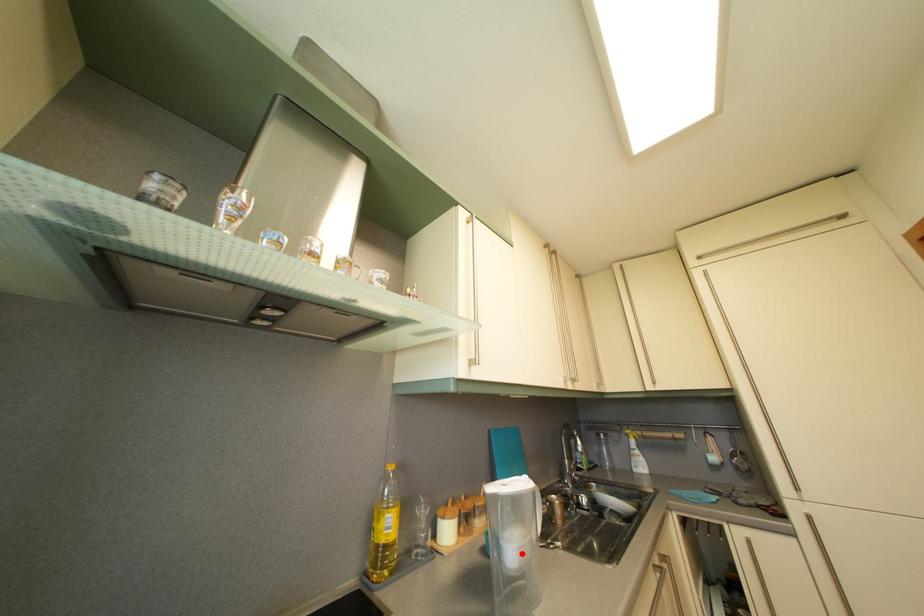
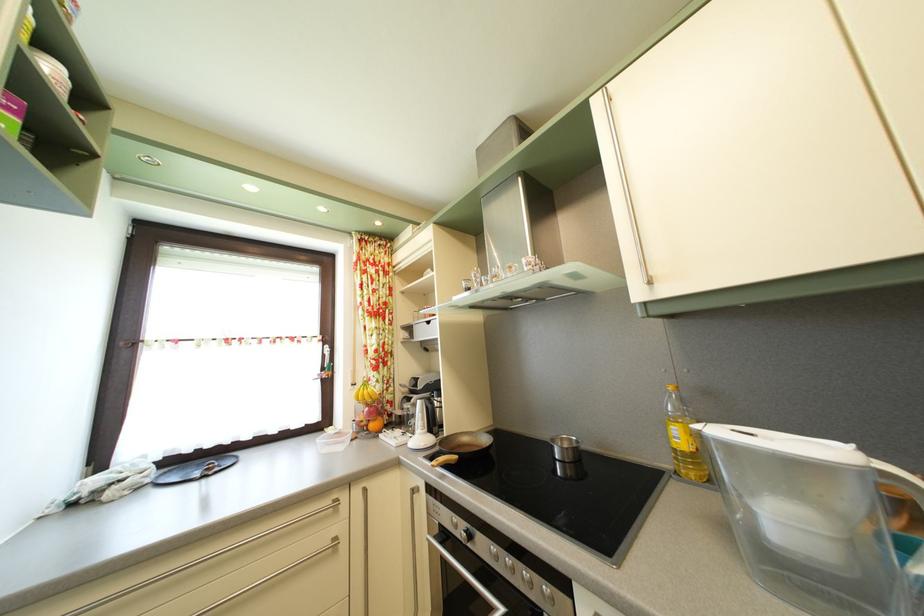
Question: I am providing you with two images of the same scene from different viewpoints. A red point is shown in image1. For the corresponding object point in image2, is it positioned nearer or farther from the camera?

Choices:
 (A) Nearer
 (B) Farther

Answer: (A)